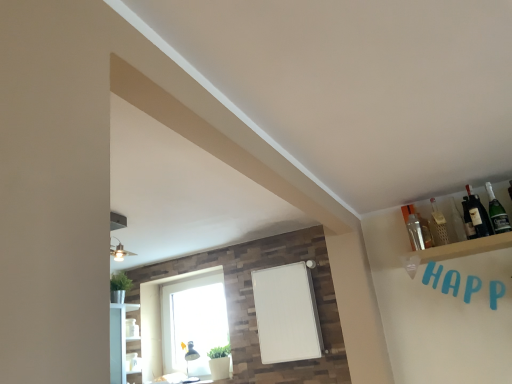
Question: Is dark glass bottle at upper right, positioned as the second bottle in right-to-left order, looking in the opposite direction of clear glass bottle at upper right, arranged as the second bottle when viewed from the left?

Choices:
 (A) no
 (B) yes

Answer: (A)

Question: Is dark glass bottle at upper right, the 4th bottle from the left, behind clear glass bottle at upper right, the 4th bottle viewed from the right?

Choices:
 (A) yes
 (B) no

Answer: (B)

Question: Considering the relative sizes of dark glass bottle at upper right, the 4th bottle from the left, and clear glass bottle at upper right, arranged as the second bottle when viewed from the left, in the image provided, is dark glass bottle at upper right, the 4th bottle from the left, shorter than clear glass bottle at upper right, arranged as the second bottle when viewed from the left,?

Choices:
 (A) no
 (B) yes

Answer: (A)

Question: Would you say dark glass bottle at upper right, positioned as the second bottle in right-to-left order, contains clear glass bottle at upper right, arranged as the second bottle when viewed from the left?

Choices:
 (A) yes
 (B) no

Answer: (B)

Question: From a real-world perspective, does dark glass bottle at upper right, positioned as the second bottle in right-to-left order, stand above clear glass bottle at upper right, arranged as the second bottle when viewed from the left?

Choices:
 (A) no
 (B) yes

Answer: (B)

Question: From the image's perspective, is dark glass bottle at upper right, the 4th bottle from the left, under clear glass bottle at upper right, the 4th bottle viewed from the right?

Choices:
 (A) yes
 (B) no

Answer: (B)

Question: Is clear glass bottle at upper right, the 4th bottle viewed from the right, closer to camera compared to white glass window at lower center?

Choices:
 (A) no
 (B) yes

Answer: (B)

Question: Can you confirm if clear glass bottle at upper right, arranged as the second bottle when viewed from the left, is taller than white glass window at lower center?

Choices:
 (A) yes
 (B) no

Answer: (B)

Question: Does clear glass bottle at upper right, arranged as the second bottle when viewed from the left, appear on the right side of white glass window at lower center?

Choices:
 (A) yes
 (B) no

Answer: (A)

Question: From the image's perspective, is clear glass bottle at upper right, the 4th bottle viewed from the right, on top of white glass window at lower center?

Choices:
 (A) yes
 (B) no

Answer: (A)

Question: Are clear glass bottle at upper right, arranged as the second bottle when viewed from the left, and white glass window at lower center beside each other?

Choices:
 (A) no
 (B) yes

Answer: (A)

Question: Can you confirm if clear glass bottle at upper right, arranged as the second bottle when viewed from the left, is thinner than white glass window at lower center?

Choices:
 (A) yes
 (B) no

Answer: (A)

Question: Is dark glass bottle at upper right, the 4th bottle from the left, far from white glass window at lower center?

Choices:
 (A) yes
 (B) no

Answer: (A)